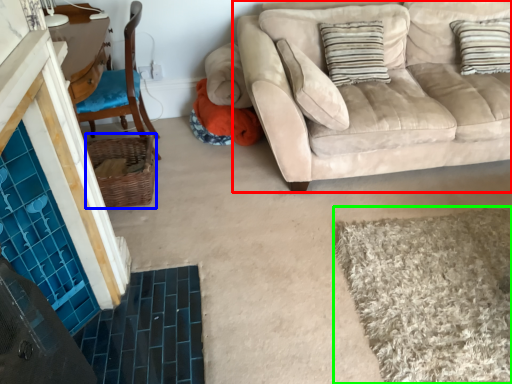
Question: Estimate the real-world distances between objects in this image. Which object is farther from studio couch (highlighted by a red box), basket (highlighted by a blue box) or bath mat (highlighted by a green box)?

Choices:
 (A) basket
 (B) bath mat

Answer: (A)